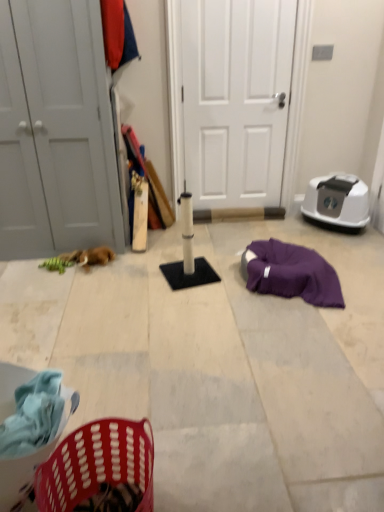
The width and height of the screenshot is (384, 512). I want to click on vacant area in front of brown plush toy at left, so click(98, 281).